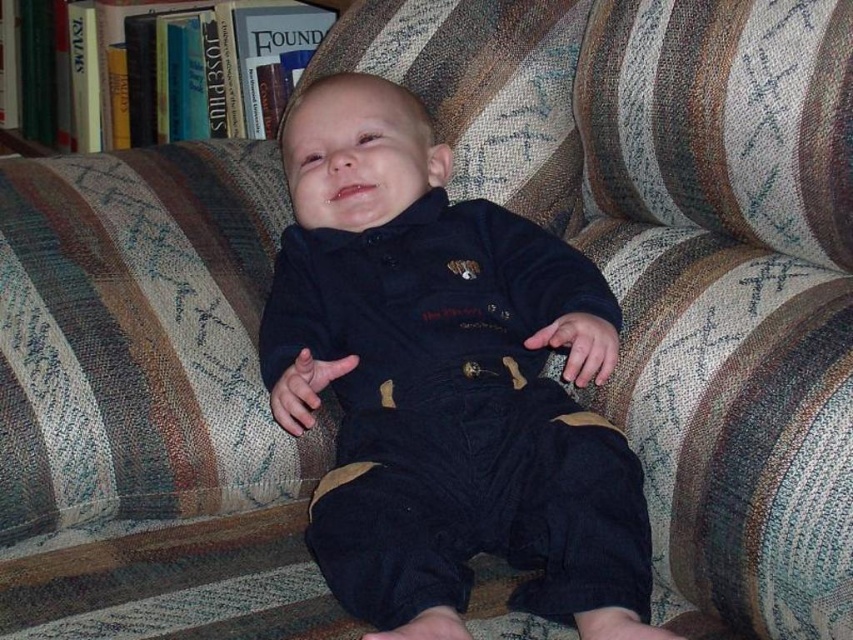
Question: Which of the following is the farthest from the observer?

Choices:
 (A) (76, 44)
 (B) (532, 410)

Answer: (A)

Question: Can you confirm if velvet dark blue onesie at center is smaller than hardcover books at upper left?

Choices:
 (A) no
 (B) yes

Answer: (A)

Question: Which point is farther to the camera?

Choices:
 (A) (103, 65)
 (B) (357, 564)

Answer: (A)

Question: Is velvet dark blue onesie at center to the right of hardcover books at upper left from the viewer's perspective?

Choices:
 (A) no
 (B) yes

Answer: (B)

Question: Does velvet dark blue onesie at center appear on the left side of hardcover books at upper left?

Choices:
 (A) no
 (B) yes

Answer: (A)